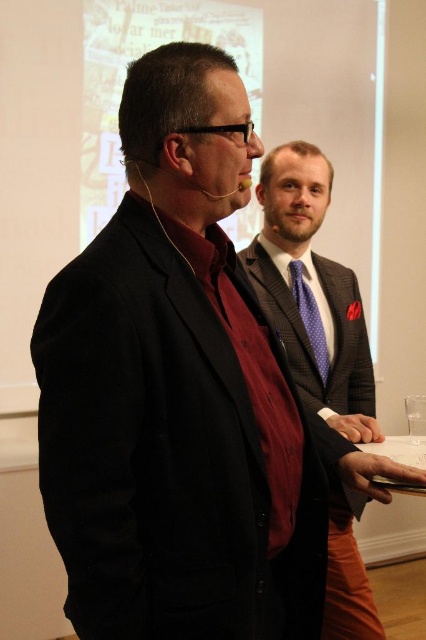
You are standing in the room and see two points marked in the image. Which point is closer to you, point (x=287, y=348) or point (x=313, y=324)?

Point (x=287, y=348) is in front of point (x=313, y=324), so it is closer to you.

You are organizing a charity event and need to decide which item to place in a donation box. The plaid wool suit at center and the purple dotted tie at center are both available. Based on their sizes, which one should you choose if you want to maximize the space used in the donation box?

The plaid wool suit at center is bigger than the purple dotted tie at center, so choosing the plaid wool suit at center will use more space in the donation box.

You are a fashion designer observing the two men in the image. You need to determine which item is higher in position between the plaid wool suit at center and the purple dotted tie at center. Which one is higher?

The plaid wool suit at center is taller than the purple dotted tie at center, so the plaid wool suit at center is higher in position.